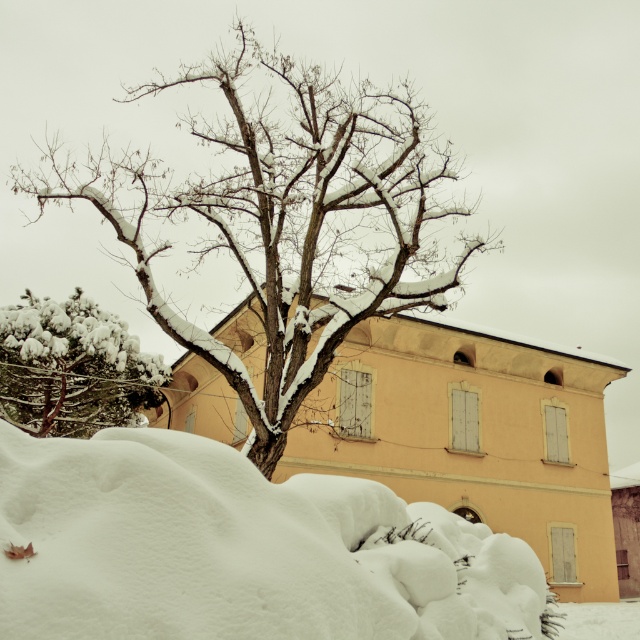
Who is positioned more to the right, white fluffy snow at lower center or snow-covered branches at center?

Positioned to the right is white fluffy snow at lower center.

Looking at this image, is white fluffy snow at lower center above snow-covered branches at center?

No.

Is point (4, 516) closer to viewer compared to point (429, 241)?

That is True.

This screenshot has width=640, height=640. I want to click on white fluffy snow at lower center, so click(237, 548).

Is point (48, 483) positioned in front of point (118, 403)?

Yes, it is in front of point (118, 403).

Is white fluffy snow at lower center above green snow-covered bush at lower left?

No.

Is point (35, 474) closer to camera compared to point (24, 364)?

Yes.

This screenshot has height=640, width=640. I want to click on white fluffy snow at lower center, so click(x=237, y=548).

Does snow-covered branches at center appear under green snow-covered bush at lower left?

Incorrect, snow-covered branches at center is not positioned below green snow-covered bush at lower left.

Does snow-covered branches at center have a greater height compared to green snow-covered bush at lower left?

Yes, snow-covered branches at center is taller than green snow-covered bush at lower left.

Between point (406, 182) and point (67, 374), which one is positioned behind?

Positioned behind is point (67, 374).

In order to click on snow-covered branches at center in this screenshot , I will do click(x=284, y=216).